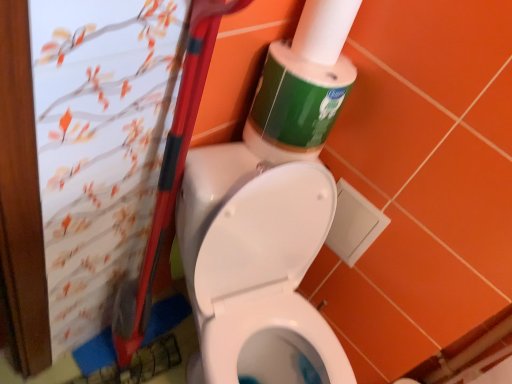
The height and width of the screenshot is (384, 512). Identify the location of green matte toilet paper at upper center. (306, 79).

Measure the distance between green matte toilet paper at upper center and camera.

32.20 inches.

What do you see at coordinates (306, 79) in the screenshot? Image resolution: width=512 pixels, height=384 pixels. I see `green matte toilet paper at upper center` at bounding box center [306, 79].

What do you see at coordinates (324, 29) in the screenshot? The height and width of the screenshot is (384, 512). I see `green matte toilet paper at upper right` at bounding box center [324, 29].

Where is `green matte toilet paper at upper right`? green matte toilet paper at upper right is located at coordinates (324, 29).

At what (x,y) coordinates should I click in order to perform the action: click on green matte toilet paper at upper center. Please return your answer as a coordinate pair (x, y). This screenshot has height=384, width=512. Looking at the image, I should click on (306, 79).

Is green matte toilet paper at upper right to the left or to the right of green matte toilet paper at upper center in the image?

Clearly, green matte toilet paper at upper right is on the right of green matte toilet paper at upper center in the image.

Does green matte toilet paper at upper right lie behind green matte toilet paper at upper center?

No, it is not.

Which is behind, point (314, 56) or point (315, 118)?

Positioned behind is point (315, 118).

From the image's perspective, is green matte toilet paper at upper right on top of green matte toilet paper at upper center?

Yes, from the image's perspective, green matte toilet paper at upper right is on top of green matte toilet paper at upper center.

Based on the photo, from a real-world perspective, does green matte toilet paper at upper right stand above green matte toilet paper at upper center?

Indeed, from a real-world perspective, green matte toilet paper at upper right stands above green matte toilet paper at upper center.

Does green matte toilet paper at upper right have a greater width compared to green matte toilet paper at upper center?

In fact, green matte toilet paper at upper right might be narrower than green matte toilet paper at upper center.

Considering the sizes of objects green matte toilet paper at upper right and green matte toilet paper at upper center in the image provided, who is taller, green matte toilet paper at upper right or green matte toilet paper at upper center?

green matte toilet paper at upper right is taller.

Can you confirm if green matte toilet paper at upper right is bigger than green matte toilet paper at upper center?

No.

Is green matte toilet paper at upper right inside or outside of green matte toilet paper at upper center?

green matte toilet paper at upper right is not inside green matte toilet paper at upper center, it's outside.

Is the surface of green matte toilet paper at upper right in direct contact with green matte toilet paper at upper center?

Yes, green matte toilet paper at upper right is next to green matte toilet paper at upper center.

Could you tell me if green matte toilet paper at upper right is facing green matte toilet paper at upper center?

No, green matte toilet paper at upper right is not aimed at green matte toilet paper at upper center.

Could you measure the distance between green matte toilet paper at upper right and green matte toilet paper at upper center?

The distance of green matte toilet paper at upper right from green matte toilet paper at upper center is 2.34 inches.

Identify the location of toilet paper above the green matte toilet paper at upper center (from the image's perspective). (324, 29).

Considering the positions of objects green matte toilet paper at upper center and green matte toilet paper at upper right in the image provided, who is more to the right, green matte toilet paper at upper center or green matte toilet paper at upper right?

From the viewer's perspective, green matte toilet paper at upper right appears more on the right side.

Which is in front, green matte toilet paper at upper center or green matte toilet paper at upper right?

green matte toilet paper at upper right.

Which is behind, point (260, 110) or point (307, 58)?

Point (260, 110)

From the image's perspective, is green matte toilet paper at upper center above green matte toilet paper at upper right?

Incorrect, from the image's perspective, green matte toilet paper at upper center is lower than green matte toilet paper at upper right.

From a real-world perspective, which is physically above, green matte toilet paper at upper center or green matte toilet paper at upper right?

In real-world perspective, green matte toilet paper at upper right is above.

Which of these two, green matte toilet paper at upper center or green matte toilet paper at upper right, is thinner?

green matte toilet paper at upper right.

Does green matte toilet paper at upper center have a greater height compared to green matte toilet paper at upper right?

No.

Considering the relative sizes of green matte toilet paper at upper center and green matte toilet paper at upper right in the image provided, is green matte toilet paper at upper center smaller than green matte toilet paper at upper right?

No.

Is green matte toilet paper at upper center inside the boundaries of green matte toilet paper at upper right, or outside?

green matte toilet paper at upper center lies outside green matte toilet paper at upper right.

Are green matte toilet paper at upper center and green matte toilet paper at upper right far apart?

No, green matte toilet paper at upper center is in close proximity to green matte toilet paper at upper right.

Is green matte toilet paper at upper center facing towards green matte toilet paper at upper right?

No.

Measure the distance from green matte toilet paper at upper center to green matte toilet paper at upper right.

green matte toilet paper at upper center and green matte toilet paper at upper right are 5.95 centimeters apart from each other.

Locate an element on the screen. cleaning product beneath the green matte toilet paper at upper right (from a real-world perspective) is located at coordinates (306, 79).

The height and width of the screenshot is (384, 512). I want to click on cleaning product that appears below the green matte toilet paper at upper right (from a real-world perspective), so click(306, 79).

The image size is (512, 384). In order to click on cleaning product behind the green matte toilet paper at upper right in this screenshot , I will do `click(306, 79)`.